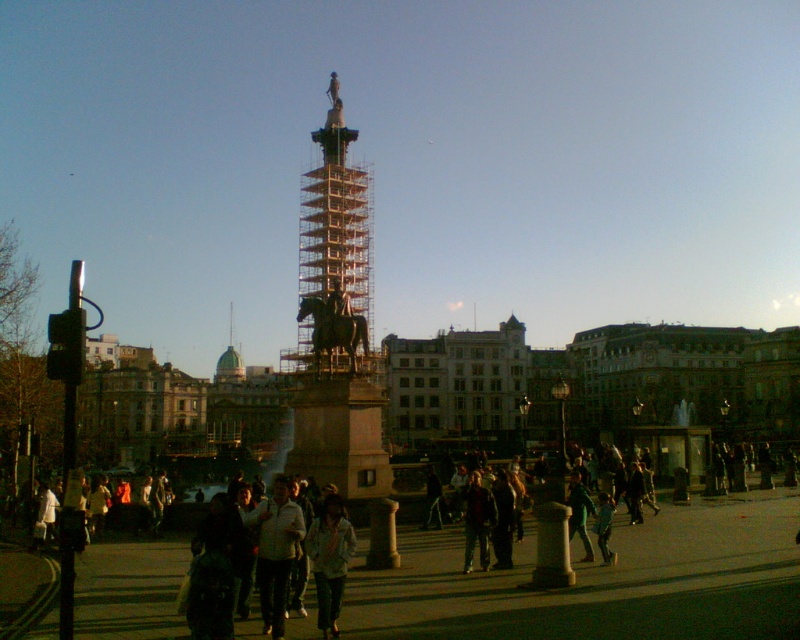
Is white cotton jacket at lower center shorter than dark gray jacket at center?

In fact, white cotton jacket at lower center may be taller than dark gray jacket at center.

Who is more distant from viewer, (272, 598) or (474, 528)?

Positioned behind is point (474, 528).

Image resolution: width=800 pixels, height=640 pixels. What are the coordinates of `white cotton jacket at lower center` in the screenshot? It's located at (276, 552).

Does light blue denim jacket at center appear over green dome at center?

No.

Does point (345, 540) come in front of point (240, 368)?

Yes.

Does point (306, 541) lie behind point (230, 364)?

No, (306, 541) is closer to viewer.

Where is `light blue denim jacket at center`? Image resolution: width=800 pixels, height=640 pixels. light blue denim jacket at center is located at coordinates (329, 561).

Is dark gray jacket at lower center in front of white cotton jacket at lower center?

Yes, it is.

Between point (262, 509) and point (274, 536), which one is positioned behind?

The point (262, 509) is behind.

Between point (212, 598) and point (270, 588), which one is positioned behind?

Positioned behind is point (270, 588).

This screenshot has height=640, width=800. Identify the location of dark gray jacket at lower center. (238, 563).